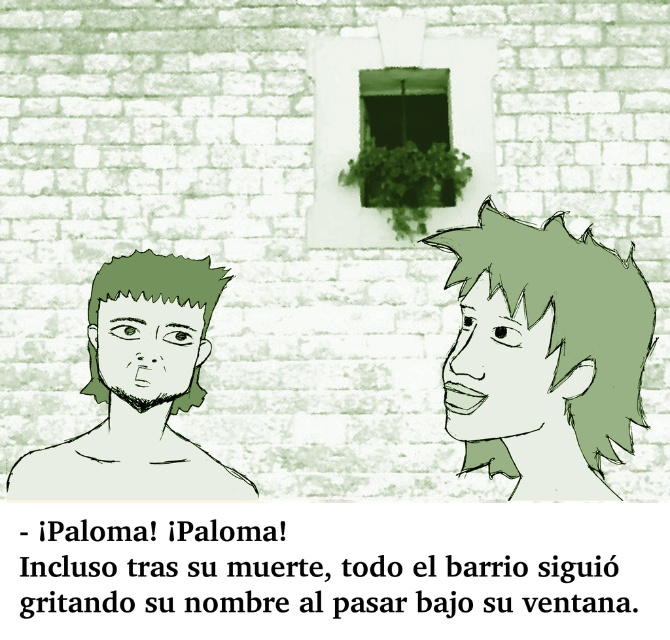
You are an artist trying to draw the scene. You want to ensure that the green spiky hair at right and the green matte face at center are positioned correctly. According to the image, which object should appear closer to the viewer?

The green spiky hair at right should appear closer to the viewer than the green matte face at center because it is positioned closer in the image.

You are an artist looking at the image and want to draw a line between the green matte head at left and the green matte face at center. Which object should you start drawing the line from to ensure it goes from left to right?

You should start drawing the line from the green matte head at left because it is positioned to the right of the green matte face at center, so starting from the left object ensures the line moves rightward.

You are an artist who wants to paint a new character between the green matte face at right and the green matte face at center. Based on the scene description, can you place the new character without overlapping either of the existing faces?

The green matte face at right is positioned over the green matte face at center, meaning they already overlap. Therefore, you cannot place a new character between them without overlapping the existing faces.